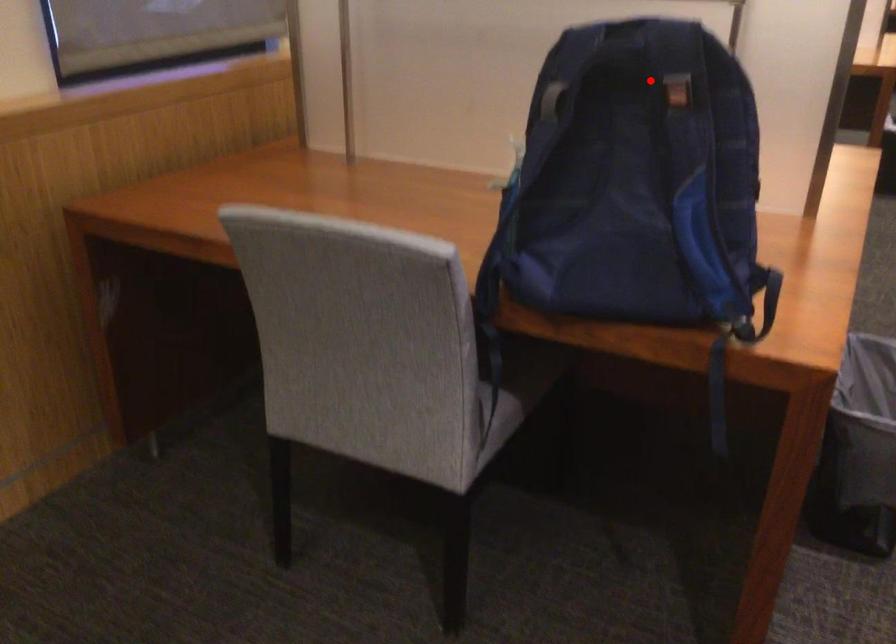
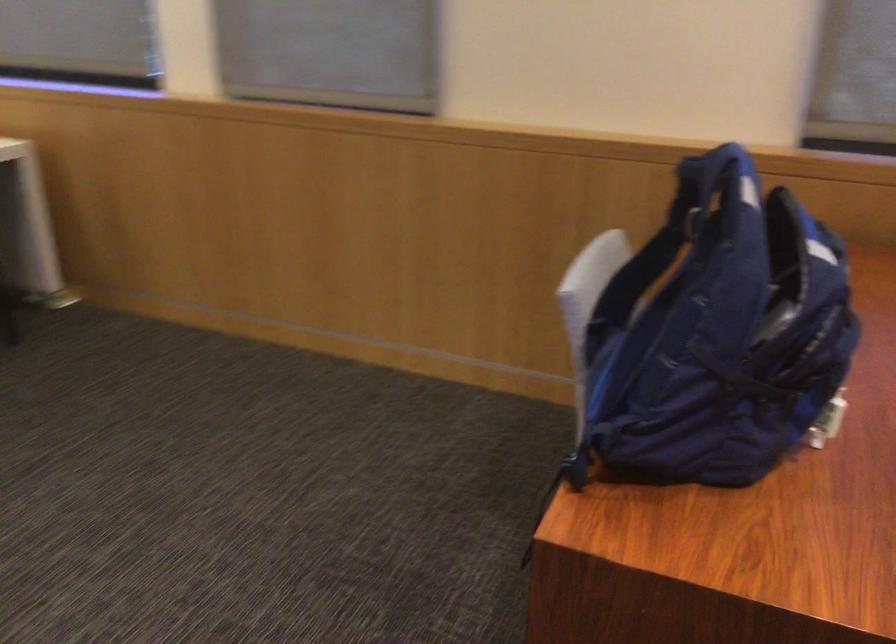
The point at the highlighted location is marked in the first image. Where is the corresponding point in the second image?

(687, 216)